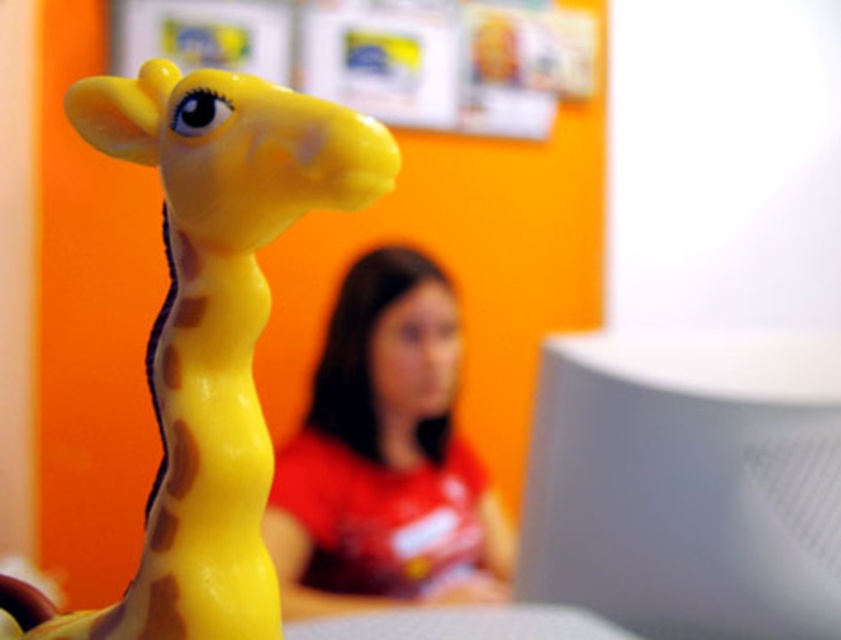
You are setting up a desk and want to place the white matte computer monitor at right and the matte plastic giraffe at center. Based on the scene, which object is lower in position?

The white matte computer monitor at right is below the matte plastic giraffe at center, so the monitor is lower.

You are a delivery robot that needs to place a package between the matte plastic giraffe at center and the matte red shirt at center. The package is 1 meter long. Can you fit the package between them?

The distance between the matte plastic giraffe at center and the matte red shirt at center is 1.20 meters, so yes, the package can fit since it is shorter than the available space.